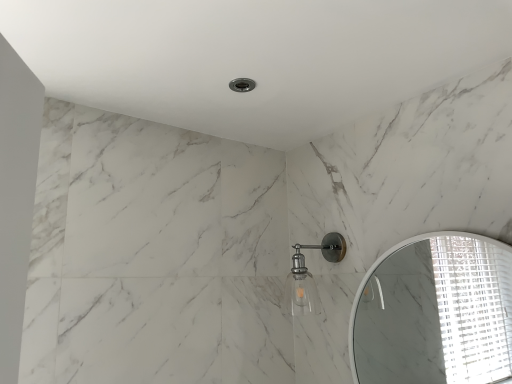
This screenshot has width=512, height=384. In order to click on white glossy mirror at upper right in this screenshot , I will do `click(435, 313)`.

Describe the element at coordinates (435, 313) in the screenshot. The image size is (512, 384). I see `white glossy mirror at upper right` at that location.

Measure the distance between white glossy mirror at upper right and camera.

Result: white glossy mirror at upper right and camera are 1.33 meters apart.

The height and width of the screenshot is (384, 512). What are the coordinates of `satin nickel fixture at upper center` in the screenshot? It's located at (310, 275).

Measure the distance between satin nickel fixture at upper center and camera.

They are 1.68 meters apart.

What do you see at coordinates (310, 275) in the screenshot? The height and width of the screenshot is (384, 512). I see `satin nickel fixture at upper center` at bounding box center [310, 275].

The width and height of the screenshot is (512, 384). Find the location of `white glossy mirror at upper right`. white glossy mirror at upper right is located at coordinates (435, 313).

Considering the positions of objects satin nickel fixture at upper center and white glossy mirror at upper right in the image provided, who is more to the left, satin nickel fixture at upper center or white glossy mirror at upper right?

Positioned to the left is satin nickel fixture at upper center.

Which is in front, satin nickel fixture at upper center or white glossy mirror at upper right?

white glossy mirror at upper right is in front.

Is point (316, 299) positioned after point (483, 248)?

No.

From the picture: From the image's perspective, which one is positioned higher, satin nickel fixture at upper center or white glossy mirror at upper right?

satin nickel fixture at upper center appears higher in the image.

Based on the photo, from a real-world perspective, is satin nickel fixture at upper center on white glossy mirror at upper right?

Yes, from a real-world perspective, satin nickel fixture at upper center is above white glossy mirror at upper right.

Is satin nickel fixture at upper center wider than white glossy mirror at upper right?

Indeed, satin nickel fixture at upper center has a greater width compared to white glossy mirror at upper right.

Consider the image. Can you confirm if satin nickel fixture at upper center is taller than white glossy mirror at upper right?

Incorrect, the height of satin nickel fixture at upper center is not larger of that of white glossy mirror at upper right.

Considering the relative sizes of satin nickel fixture at upper center and white glossy mirror at upper right in the image provided, is satin nickel fixture at upper center bigger than white glossy mirror at upper right?

Actually, satin nickel fixture at upper center might be smaller than white glossy mirror at upper right.

Would you say white glossy mirror at upper right is part of satin nickel fixture at upper center's contents?

No, satin nickel fixture at upper center does not contain white glossy mirror at upper right.

Is there a large distance between satin nickel fixture at upper center and white glossy mirror at upper right?

satin nickel fixture at upper center is positioned a significant distance from white glossy mirror at upper right.

From the picture: Is satin nickel fixture at upper center turned away from white glossy mirror at upper right?

No.

What's the angular difference between satin nickel fixture at upper center and white glossy mirror at upper right's facing directions?

There is a 1.65-degree angle between the facing directions of satin nickel fixture at upper center and white glossy mirror at upper right.

Where is `shower on the left of white glossy mirror at upper right`? shower on the left of white glossy mirror at upper right is located at coordinates (310, 275).

Between white glossy mirror at upper right and satin nickel fixture at upper center, which one appears on the right side from the viewer's perspective?

white glossy mirror at upper right.

Considering their positions, is white glossy mirror at upper right located in front of or behind satin nickel fixture at upper center?

Clearly, white glossy mirror at upper right is in front of satin nickel fixture at upper center.

Is point (478, 354) positioned behind point (304, 271)?

Yes, point (478, 354) is farther from viewer.

From the image's perspective, between white glossy mirror at upper right and satin nickel fixture at upper center, who is located below?

white glossy mirror at upper right.

From a real-world perspective, is white glossy mirror at upper right physically below satin nickel fixture at upper center?

Yes.

From the picture: Considering the relative sizes of white glossy mirror at upper right and satin nickel fixture at upper center in the image provided, is white glossy mirror at upper right thinner than satin nickel fixture at upper center?

Correct, the width of white glossy mirror at upper right is less than that of satin nickel fixture at upper center.

Is white glossy mirror at upper right taller than satin nickel fixture at upper center?

Yes.

Considering the relative sizes of white glossy mirror at upper right and satin nickel fixture at upper center in the image provided, is white glossy mirror at upper right bigger than satin nickel fixture at upper center?

Yes, white glossy mirror at upper right is bigger than satin nickel fixture at upper center.

Is white glossy mirror at upper right situated inside satin nickel fixture at upper center or outside?

The correct answer is: outside.

Are white glossy mirror at upper right and satin nickel fixture at upper center far apart?

Yes, white glossy mirror at upper right and satin nickel fixture at upper center are quite far apart.

Could you tell me if white glossy mirror at upper right is turned towards satin nickel fixture at upper center?

No, white glossy mirror at upper right is not turned towards satin nickel fixture at upper center.

What's the angular difference between white glossy mirror at upper right and satin nickel fixture at upper center's facing directions?

1.65 degrees.

How much distance is there between white glossy mirror at upper right and satin nickel fixture at upper center?

white glossy mirror at upper right is 3.32 feet away from satin nickel fixture at upper center.

In the image, there is a satin nickel fixture at upper center. Where is `mirror below it (from a real-world perspective)`? The image size is (512, 384). mirror below it (from a real-world perspective) is located at coordinates click(435, 313).

At what (x,y) coordinates should I click in order to perform the action: click on shower located on the left of white glossy mirror at upper right. Please return your answer as a coordinate pair (x, y). Looking at the image, I should click on (310, 275).

Where is `mirror located in front of the satin nickel fixture at upper center`? Image resolution: width=512 pixels, height=384 pixels. mirror located in front of the satin nickel fixture at upper center is located at coordinates (435, 313).